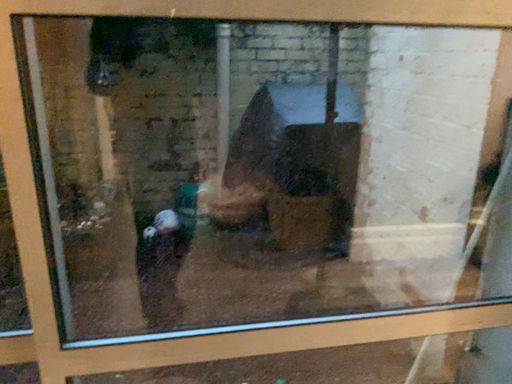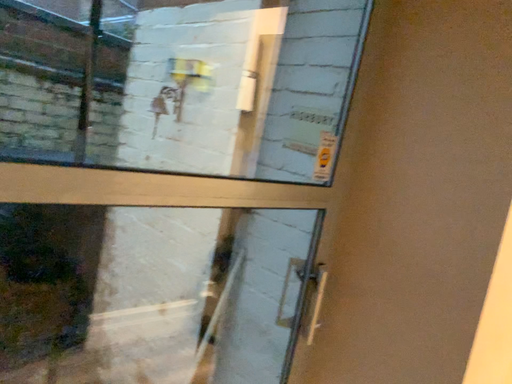
Question: How did the camera likely rotate when shooting the video?

Choices:
 (A) rotated right
 (B) rotated left

Answer: (A)